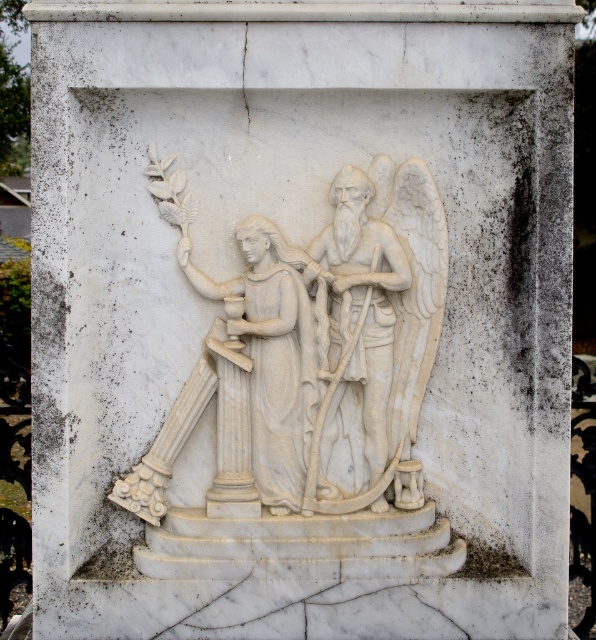
Question: Does white marble sculpture at center appear under white marble angel at center?

Choices:
 (A) yes
 (B) no

Answer: (A)

Question: Which point is closer to the camera?

Choices:
 (A) (336, 186)
 (B) (234, 292)
 (C) (166, 202)

Answer: (A)

Question: Can you confirm if white marble angel at center is positioned below white marble statue at left?

Choices:
 (A) yes
 (B) no

Answer: (B)

Question: Which object is closer to the camera taking this photo?

Choices:
 (A) white marble angel at center
 (B) white marble sculpture at center
 (C) white marble statue at left

Answer: (A)

Question: Does white marble angel at center appear on the left side of white marble statue at left?

Choices:
 (A) yes
 (B) no

Answer: (B)

Question: Among these objects, which one is nearest to the camera?

Choices:
 (A) white marble angel at center
 (B) white marble statue at left
 (C) white marble sculpture at center

Answer: (A)